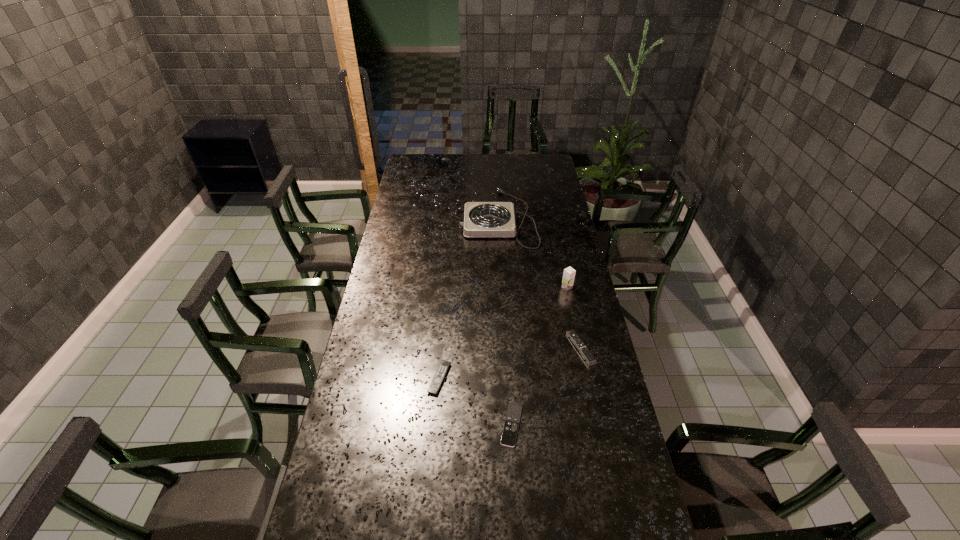
In the image, there is a desktop. At what (x,y) coordinates should I click in order to perform the action: click on vacant space at the far edge. Please return your answer as a coordinate pair (x, y). This screenshot has width=960, height=540. Looking at the image, I should click on (459, 158).

This screenshot has width=960, height=540. Identify the location of free space at the left edge. (418, 210).

Identify the location of vacant space at the right edge of the desktop. This screenshot has width=960, height=540. (578, 292).

Locate an element on the screen. free region at the far right corner of the desktop is located at coordinates (529, 164).

This screenshot has height=540, width=960. I want to click on vacant region between the second shortest object and the second tallest object, so 468,298.

You are a GUI agent. You are given a task and a screenshot of the screen. Output one action in this format:
    pyautogui.click(x=<x>, y=<y>)
    Task: Click on the vacant area that lies between the farthest object and the leftmost remote control
    The height and width of the screenshot is (540, 960).
    Given the screenshot: What is the action you would take?
    pyautogui.click(x=468, y=298)

Find the location of a particular element. This screenshot has width=960, height=540. free space between the farthest object and the fourth tallest object is located at coordinates (468, 298).

Where is `vacant space that is in between the nearest object and the second shortest remote control`? vacant space that is in between the nearest object and the second shortest remote control is located at coordinates (475, 402).

What are the coordinates of `vacant point located between the fourth nearest object and the tallest remote control` in the screenshot? It's located at (574, 318).

I want to click on empty location between the shortest remote control and the rightmost remote control, so tap(546, 387).